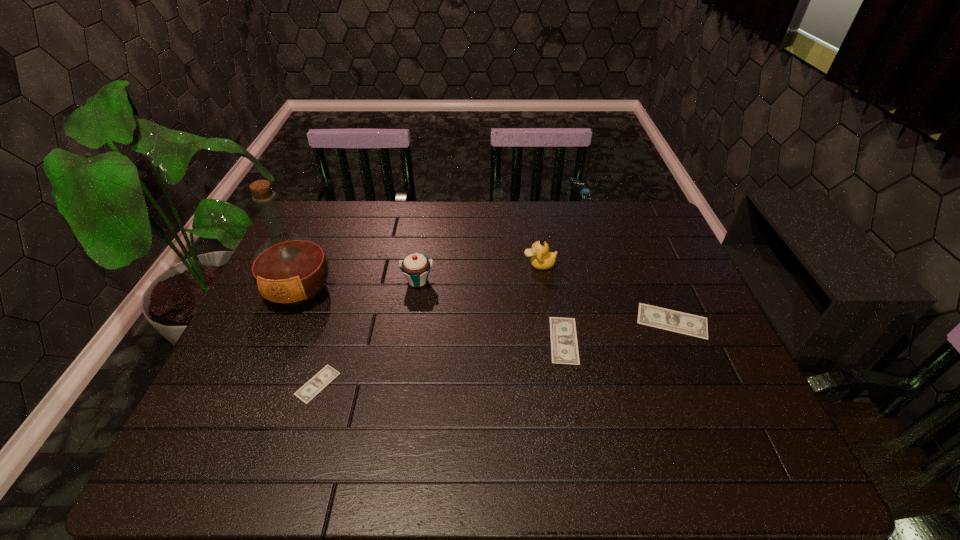
I want to click on free spot between the shortest object and the second shortest object, so click(x=441, y=362).

Locate an element on the screen. The width and height of the screenshot is (960, 540). vacant point located between the second shortest object and the shortest object is located at coordinates (441, 362).

The image size is (960, 540). I want to click on object that stands as the fourth closest to the fourth object from right to left, so click(564, 348).

Select which object appears as the fourth closest to the shortest object. Please provide its 2D coordinates. Your answer should be formatted as a tuple, i.e. [(x, y)], where the tuple contains the x and y coordinates of a point satisfying the conditions above.

[(541, 259)]

Locate an element on the screen. The height and width of the screenshot is (540, 960). money that stands as the closest to the rightmost object is located at coordinates (564, 348).

Locate which money is the second closest to the duckling. Please provide its 2D coordinates. Your answer should be formatted as a tuple, i.e. [(x, y)], where the tuple contains the x and y coordinates of a point satisfying the conditions above.

[(683, 323)]

Where is `free space that satisfies the following two spatial constraints: 1. on the back side of the second money from right to left; 2. on the right side of the rightmost object`? The height and width of the screenshot is (540, 960). free space that satisfies the following two spatial constraints: 1. on the back side of the second money from right to left; 2. on the right side of the rightmost object is located at coordinates (561, 321).

This screenshot has height=540, width=960. What are the coordinates of `free spot that satisfies the following two spatial constraints: 1. on the front label of the second tallest money; 2. on the left side of the liquor` in the screenshot? It's located at (277, 340).

Find the location of a particular element. free location that satisfies the following two spatial constraints: 1. on the front label of the liquor; 2. on the right side of the shortest object is located at coordinates (259, 384).